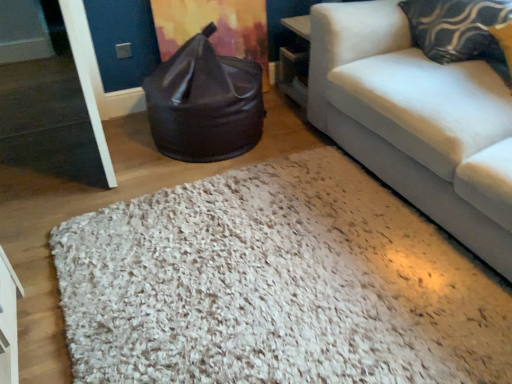
Question: Considering the positions of patterned fabric pillow at upper right and black leather bean bag at center in the image, is patterned fabric pillow at upper right bigger or smaller than black leather bean bag at center?

Choices:
 (A) big
 (B) small

Answer: (B)

Question: Considering the positions of patterned fabric pillow at upper right and black leather bean bag at center in the image, is patterned fabric pillow at upper right wider or thinner than black leather bean bag at center?

Choices:
 (A) thin
 (B) wide

Answer: (A)

Question: Considering the real-world distances, which object is closest to the patterned fabric pillow at upper right?

Choices:
 (A) black leather bean bag at center
 (B) white shaggy rug at center

Answer: (A)

Question: Considering the real-world distances, which object is closest to the black leather bean bag at center?

Choices:
 (A) white shaggy rug at center
 (B) patterned fabric pillow at upper right

Answer: (A)